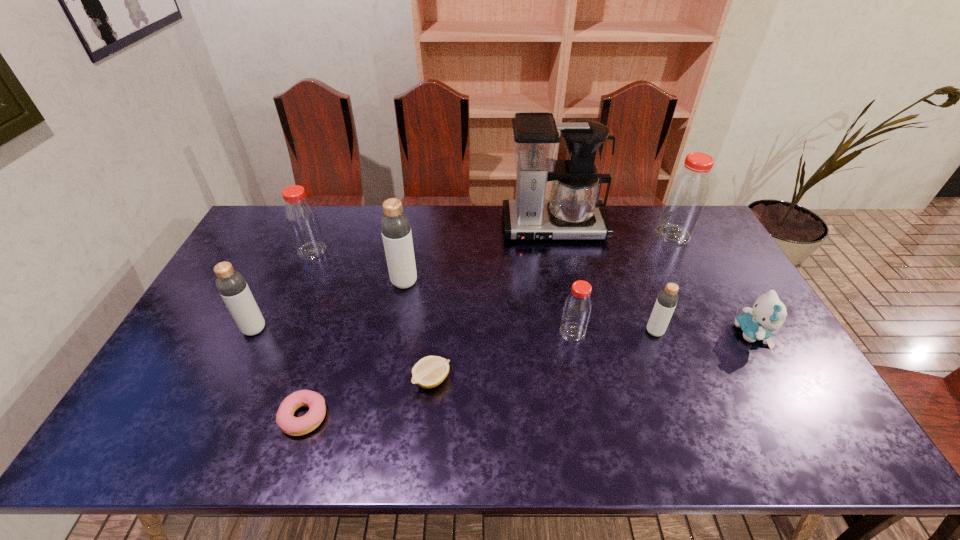
I want to click on vacant space that satisfies the following two spatial constraints: 1. on the front side of the leftmost gray bottle; 2. on the left side of the smallest red bottle, so click(x=252, y=332).